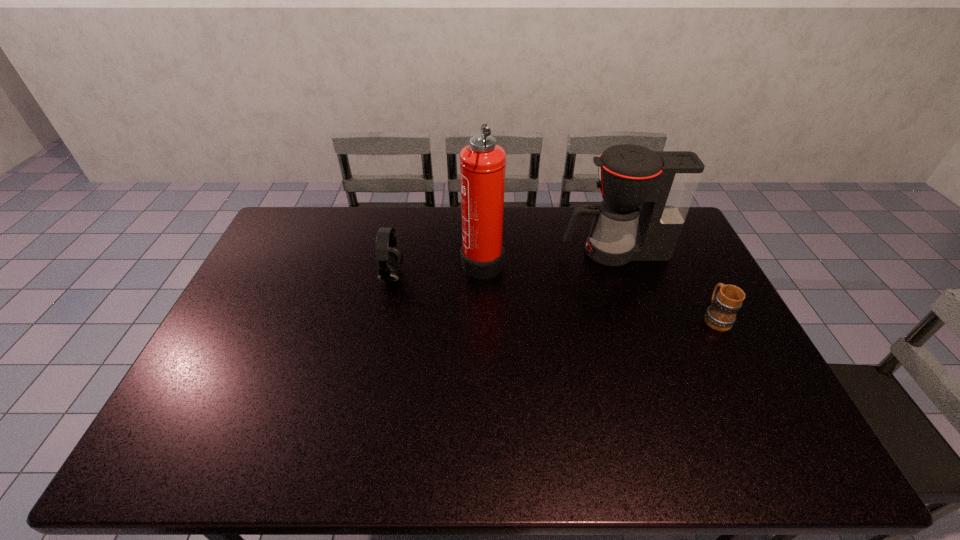
This screenshot has width=960, height=540. What are the coordinates of `coffee maker present at the right edge` in the screenshot? It's located at (664, 183).

Identify the location of mug present at the right edge. This screenshot has height=540, width=960. 721,315.

Where is `object that is positioned at the far right corner`? The width and height of the screenshot is (960, 540). object that is positioned at the far right corner is located at coordinates (664, 183).

Image resolution: width=960 pixels, height=540 pixels. I want to click on free location at the far edge of the desktop, so click(x=533, y=220).

This screenshot has width=960, height=540. In the image, there is a desktop. Find the location of `vacant space at the near edge`. vacant space at the near edge is located at coordinates (502, 460).

I want to click on vacant space at the left edge of the desktop, so click(249, 379).

At what (x,y) coordinates should I click in order to perform the action: click on free space at the right edge of the desktop. Please return your answer as a coordinate pair (x, y). Looking at the image, I should click on (660, 275).

You are a GUI agent. You are given a task and a screenshot of the screen. Output one action in this format:
    pyautogui.click(x=<x>, y=<y>)
    Task: Click on the vacant space at the far left corner of the desktop
    This screenshot has width=960, height=540.
    Given the screenshot: What is the action you would take?
    pyautogui.click(x=294, y=228)

This screenshot has height=540, width=960. I want to click on free space between the earphone and the shortest object, so click(x=553, y=297).

Where is `vacant space that's between the coffee maker and the rightmost object`? The width and height of the screenshot is (960, 540). vacant space that's between the coffee maker and the rightmost object is located at coordinates (664, 285).